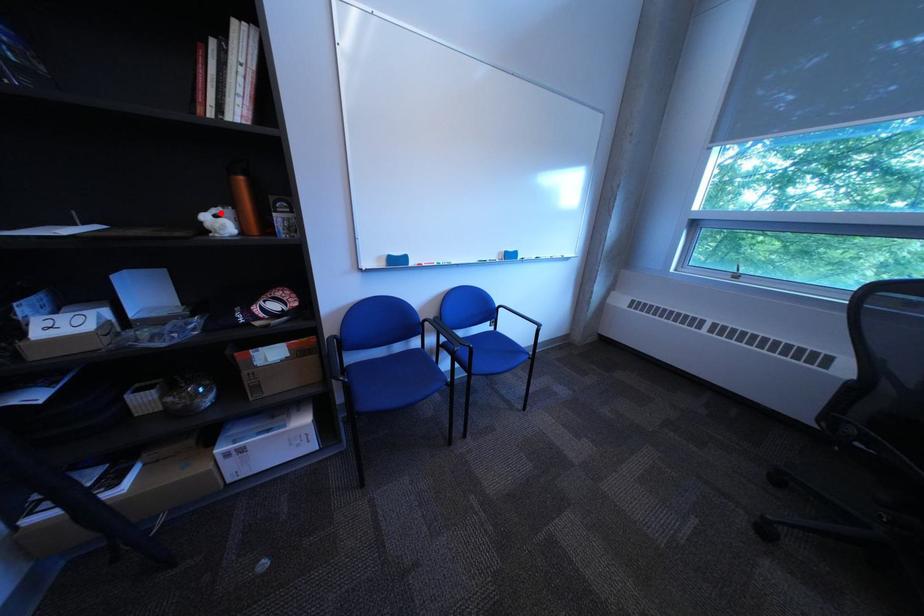
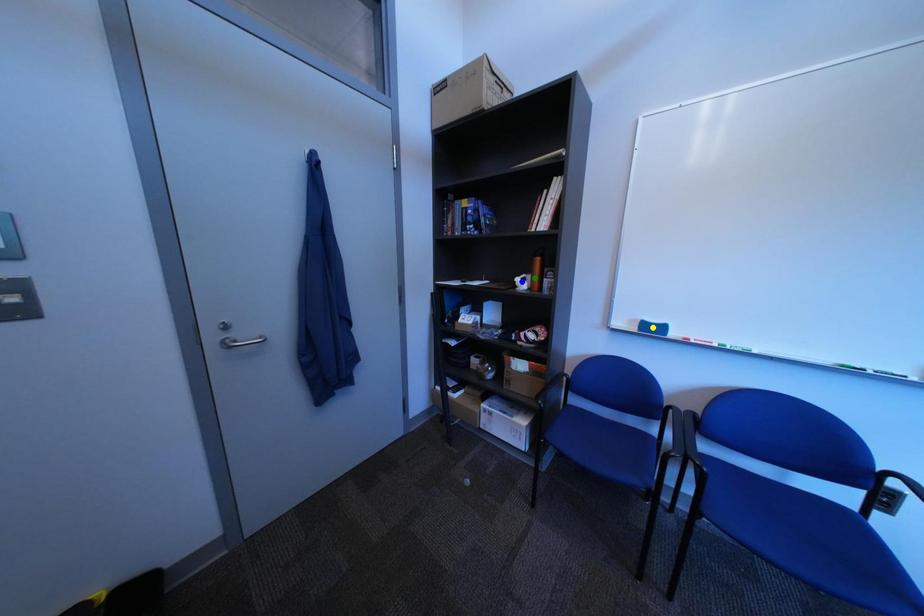
Question: I am providing you with two images of the same scene from different viewpoints. A red point is marked on the first image. You are given multiple points on the second image. Which point in image 2 is actually the same real-world point as the red point in image 1?

Choices:
 (A) green point
 (B) yellow point
 (C) blue point

Answer: (A)